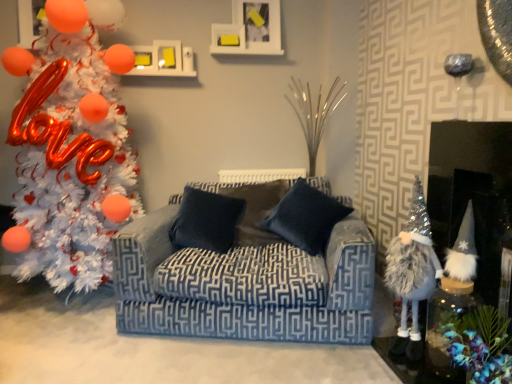
This screenshot has width=512, height=384. Describe the element at coordinates (306, 218) in the screenshot. I see `dark blue fabric pillow at center, positioned as the 2th pillow in left-to-right order` at that location.

The image size is (512, 384). Identify the location of dark blue fabric pillow at center, marked as the first pillow in a left-to-right arrangement. [x=206, y=221].

Image resolution: width=512 pixels, height=384 pixels. What are the coordinates of `velvet blue couch at center` in the screenshot? It's located at (244, 286).

You are a GUI agent. You are given a task and a screenshot of the screen. Output one action in this format:
    pyautogui.click(x=<x>, y=<y>)
    Task: Click on the white tinsel christmas tree at left
    Image resolution: width=512 pixels, height=384 pixels.
    Given the screenshot: What is the action you would take?
    pyautogui.click(x=71, y=147)

Is point (64, 93) positioned after point (207, 298)?

Yes, it is behind point (207, 298).

From the image's perspective, is white tinsel christmas tree at left located beneath velvet blue couch at center?

Incorrect, from the image's perspective, white tinsel christmas tree at left is higher than velvet blue couch at center.

Considering the relative positions of white tinsel christmas tree at left and velvet blue couch at center in the image provided, is white tinsel christmas tree at left to the left or to the right of velvet blue couch at center?

white tinsel christmas tree at left is positioned on velvet blue couch at center's left side.

From a real-world perspective, is white tinsel christmas tree at left physically below velvet blue couch at center?

Actually, white tinsel christmas tree at left is physically above velvet blue couch at center in the real world.

Is the surface of dark blue fabric pillow at center, positioned as the 2th pillow in left-to-right order, in direct contact with dark blue fabric pillow at center, marked as the first pillow in a left-to-right arrangement?

No, dark blue fabric pillow at center, positioned as the 2th pillow in left-to-right order, is not making contact with dark blue fabric pillow at center, marked as the first pillow in a left-to-right arrangement.

Can you confirm if dark blue fabric pillow at center, positioned as the 2th pillow in left-to-right order, is wider than dark blue fabric pillow at center, the second pillow viewed from the right?

Yes, dark blue fabric pillow at center, positioned as the 2th pillow in left-to-right order, is wider than dark blue fabric pillow at center, the second pillow viewed from the right.

Based on the photo, can you confirm if white tinsel christmas tree at left is smaller than dark blue fabric pillow at center, positioned as the 2th pillow in left-to-right order?

Incorrect, white tinsel christmas tree at left is not smaller in size than dark blue fabric pillow at center, positioned as the 2th pillow in left-to-right order.

In terms of height, does white tinsel christmas tree at left look taller or shorter compared to dark blue fabric pillow at center, which appears as the 1th pillow when viewed from the right?

Considering their sizes, white tinsel christmas tree at left has more height than dark blue fabric pillow at center, which appears as the 1th pillow when viewed from the right.

Can you tell me how much white tinsel christmas tree at left and dark blue fabric pillow at center, which appears as the 1th pillow when viewed from the right, differ in facing direction?

The angle between the facing direction of white tinsel christmas tree at left and the facing direction of dark blue fabric pillow at center, which appears as the 1th pillow when viewed from the right, is 19.2 degrees.

Considering the sizes of objects white tinsel christmas tree at left and dark blue fabric pillow at center, positioned as the 2th pillow in left-to-right order, in the image provided, who is wider, white tinsel christmas tree at left or dark blue fabric pillow at center, positioned as the 2th pillow in left-to-right order,?

white tinsel christmas tree at left is wider.

Which of these two, velvet blue couch at center or dark blue fabric pillow at center, which appears as the 1th pillow when viewed from the right, is wider?

With larger width is velvet blue couch at center.

Based on the photo, how different are the orientations of velvet blue couch at center and dark blue fabric pillow at center, positioned as the 2th pillow in left-to-right order, in degrees?

There is a 0.000299-degree angle between the facing directions of velvet blue couch at center and dark blue fabric pillow at center, positioned as the 2th pillow in left-to-right order.

Is velvet blue couch at center looking in the opposite direction of dark blue fabric pillow at center, positioned as the 2th pillow in left-to-right order?

Yes, velvet blue couch at center is positioned with its back facing dark blue fabric pillow at center, positioned as the 2th pillow in left-to-right order.

Considering the relative sizes of white fluffy gnome at lower right and dark blue fabric pillow at center, the second pillow viewed from the right, in the image provided, is white fluffy gnome at lower right wider than dark blue fabric pillow at center, the second pillow viewed from the right,?

Yes, white fluffy gnome at lower right is wider than dark blue fabric pillow at center, the second pillow viewed from the right.

Is white fluffy gnome at lower right turned away from dark blue fabric pillow at center, the second pillow viewed from the right?

No.

Between white fluffy gnome at lower right and dark blue fabric pillow at center, marked as the first pillow in a left-to-right arrangement, which one is positioned behind?

dark blue fabric pillow at center, marked as the first pillow in a left-to-right arrangement, is further from the camera.

From the image's perspective, is white fluffy gnome at lower right above or below dark blue fabric pillow at center, the second pillow viewed from the right?

Clearly, from the image's perspective, white fluffy gnome at lower right is below dark blue fabric pillow at center, the second pillow viewed from the right.

Is fuzzy silver gnome at right, which ranks as the second toy in right-to-left order, bigger than fuzzy silver gnome at right, which is the 2th toy in left-to-right order?

Yes.

Considering the positions of objects fuzzy silver gnome at right, which ranks as the second toy in right-to-left order, and fuzzy silver gnome at right, which appears as the 1th toy when viewed from the right, in the image provided, who is more to the left, fuzzy silver gnome at right, which ranks as the second toy in right-to-left order, or fuzzy silver gnome at right, which appears as the 1th toy when viewed from the right,?

fuzzy silver gnome at right, which ranks as the second toy in right-to-left order.

Which of these two, fuzzy silver gnome at right, which ranks as the second toy in right-to-left order, or fuzzy silver gnome at right, which appears as the 1th toy when viewed from the right, is thinner?

fuzzy silver gnome at right, which ranks as the second toy in right-to-left order.

From a real-world perspective, is fuzzy silver gnome at right, which ranks as the second toy in right-to-left order, beneath fuzzy silver gnome at right, which is the 2th toy in left-to-right order?

Yes, from a real-world perspective, fuzzy silver gnome at right, which ranks as the second toy in right-to-left order, is under fuzzy silver gnome at right, which is the 2th toy in left-to-right order.

Considering the relative sizes of dark blue fabric pillow at center, positioned as the 2th pillow in left-to-right order, and velvet blue couch at center in the image provided, is dark blue fabric pillow at center, positioned as the 2th pillow in left-to-right order, shorter than velvet blue couch at center?

Correct, dark blue fabric pillow at center, positioned as the 2th pillow in left-to-right order, is not as tall as velvet blue couch at center.

Between dark blue fabric pillow at center, positioned as the 2th pillow in left-to-right order, and velvet blue couch at center, which one has larger size?

velvet blue couch at center is bigger.

Is dark blue fabric pillow at center, which appears as the 1th pillow when viewed from the right, aimed at velvet blue couch at center?

Yes, dark blue fabric pillow at center, which appears as the 1th pillow when viewed from the right, is facing velvet blue couch at center.

Looking at this image, how different are the orientations of dark blue fabric pillow at center, positioned as the 2th pillow in left-to-right order, and velvet blue couch at center in degrees?

The angle between the facing direction of dark blue fabric pillow at center, positioned as the 2th pillow in left-to-right order, and the facing direction of velvet blue couch at center is 0.000299 degrees.

I want to click on christmas tree located above the velvet blue couch at center (from a real-world perspective), so click(x=71, y=147).

You are a GUI agent. You are given a task and a screenshot of the screen. Output one action in this format:
    pyautogui.click(x=<x>, y=<y>)
    Task: Click on the pillow lying behind the dark blue fabric pillow at center, which appears as the 1th pillow when viewed from the right
    This screenshot has height=384, width=512.
    Given the screenshot: What is the action you would take?
    pyautogui.click(x=206, y=221)

When comparing their distances from fuzzy silver gnome at right, which appears as the 1th toy when viewed from the right, does dark blue fabric pillow at center, marked as the first pillow in a left-to-right arrangement, or fuzzy silver gnome at right, which ranks as the second toy in right-to-left order, seem closer?

fuzzy silver gnome at right, which ranks as the second toy in right-to-left order, lies closer to fuzzy silver gnome at right, which appears as the 1th toy when viewed from the right, than the other object.

Looking at the image, which one is located closer to white tinsel christmas tree at left, dark blue fabric pillow at center, marked as the first pillow in a left-to-right arrangement, or dark blue fabric pillow at center, which appears as the 1th pillow when viewed from the right?

dark blue fabric pillow at center, marked as the first pillow in a left-to-right arrangement, lies closer to white tinsel christmas tree at left than the other object.

Based on their spatial positions, is fuzzy silver gnome at right, which ranks as the second toy in right-to-left order, or white fluffy gnome at lower right closer to dark blue fabric pillow at center, marked as the first pillow in a left-to-right arrangement?

fuzzy silver gnome at right, which ranks as the second toy in right-to-left order.

In the scene shown: When comparing their distances from fuzzy silver gnome at right, which ranks as the second toy in right-to-left order, does velvet blue couch at center or dark blue fabric pillow at center, positioned as the 2th pillow in left-to-right order, seem closer?

velvet blue couch at center is closer to fuzzy silver gnome at right, which ranks as the second toy in right-to-left order.

Which object lies nearer to the anchor point dark blue fabric pillow at center, which appears as the 1th pillow when viewed from the right, fuzzy silver gnome at right, which is the first toy in left-to-right order, or white tinsel christmas tree at left?

fuzzy silver gnome at right, which is the first toy in left-to-right order, is closer to dark blue fabric pillow at center, which appears as the 1th pillow when viewed from the right.

From the image, which object appears to be nearer to dark blue fabric pillow at center, the second pillow viewed from the right, white tinsel christmas tree at left or velvet blue couch at center?

Based on the image, velvet blue couch at center appears to be nearer to dark blue fabric pillow at center, the second pillow viewed from the right.

When comparing their distances from fuzzy silver gnome at right, which is the 2th toy in left-to-right order, does dark blue fabric pillow at center, positioned as the 2th pillow in left-to-right order, or white tinsel christmas tree at left seem closer?

Based on the image, dark blue fabric pillow at center, positioned as the 2th pillow in left-to-right order, appears to be nearer to fuzzy silver gnome at right, which is the 2th toy in left-to-right order.

When comparing their distances from dark blue fabric pillow at center, marked as the first pillow in a left-to-right arrangement, does fuzzy silver gnome at right, which appears as the 1th toy when viewed from the right, or dark blue fabric pillow at center, positioned as the 2th pillow in left-to-right order, seem further?

The object further to dark blue fabric pillow at center, marked as the first pillow in a left-to-right arrangement, is fuzzy silver gnome at right, which appears as the 1th toy when viewed from the right.

What are the coordinates of `toy between dark blue fabric pillow at center, the second pillow viewed from the right, and white fluffy gnome at lower right, in the horizontal direction` in the screenshot? It's located at (413, 262).

Locate an element on the screen. This screenshot has height=384, width=512. pillow between white tinsel christmas tree at left and dark blue fabric pillow at center, positioned as the 2th pillow in left-to-right order is located at coordinates (206, 221).

I want to click on toy between white fluffy gnome at lower right and fuzzy silver gnome at right, which ranks as the second toy in right-to-left order, along the z-axis, so click(x=461, y=258).

The image size is (512, 384). I want to click on studio couch between white tinsel christmas tree at left and fuzzy silver gnome at right, which ranks as the second toy in right-to-left order, in the horizontal direction, so click(244, 286).